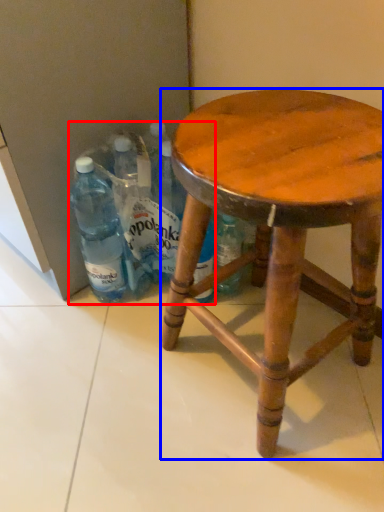
Question: Among these objects, which one is nearest to the camera, beverage (highlighted by a red box) or stool (highlighted by a blue box)?

Choices:
 (A) beverage
 (B) stool

Answer: (B)